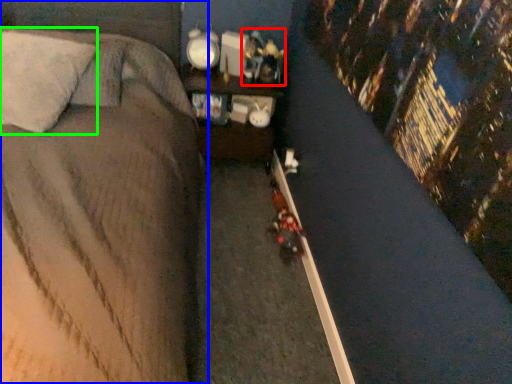
Question: Which is farther away from toy (highlighted by a red box)? bed (highlighted by a blue box) or pillow (highlighted by a green box)?

Choices:
 (A) bed
 (B) pillow

Answer: (B)